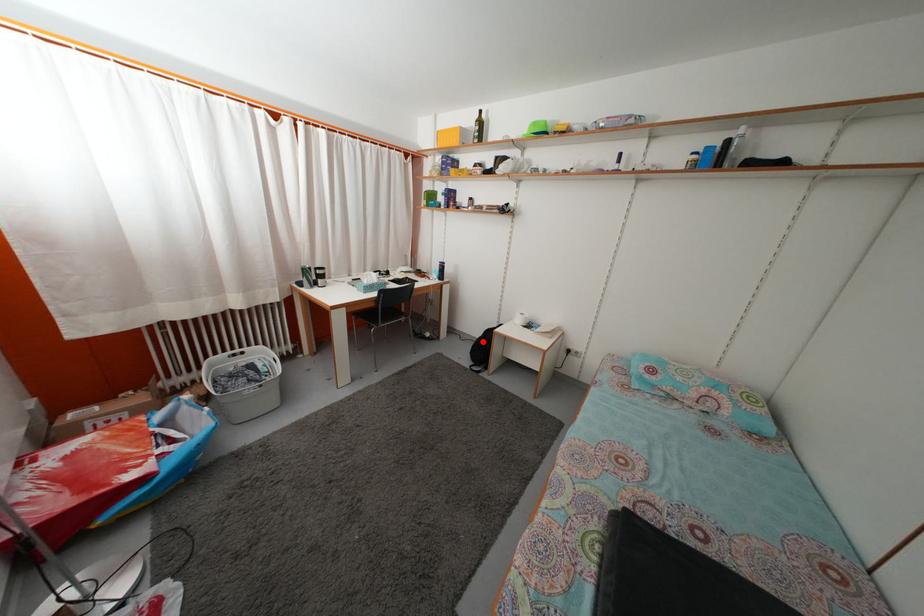
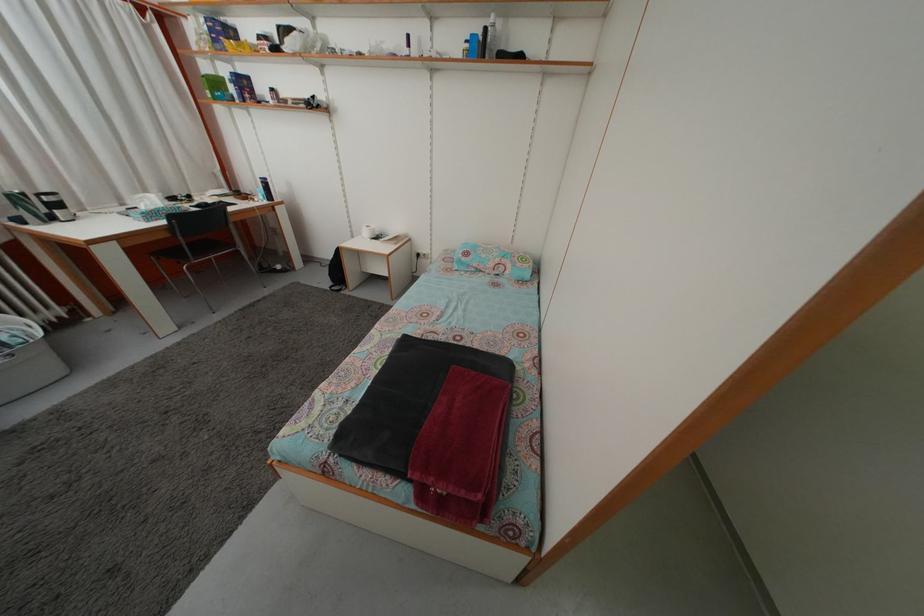
Locate, in the second image, the point that corresponds to the highlighted location in the first image.

(335, 262)